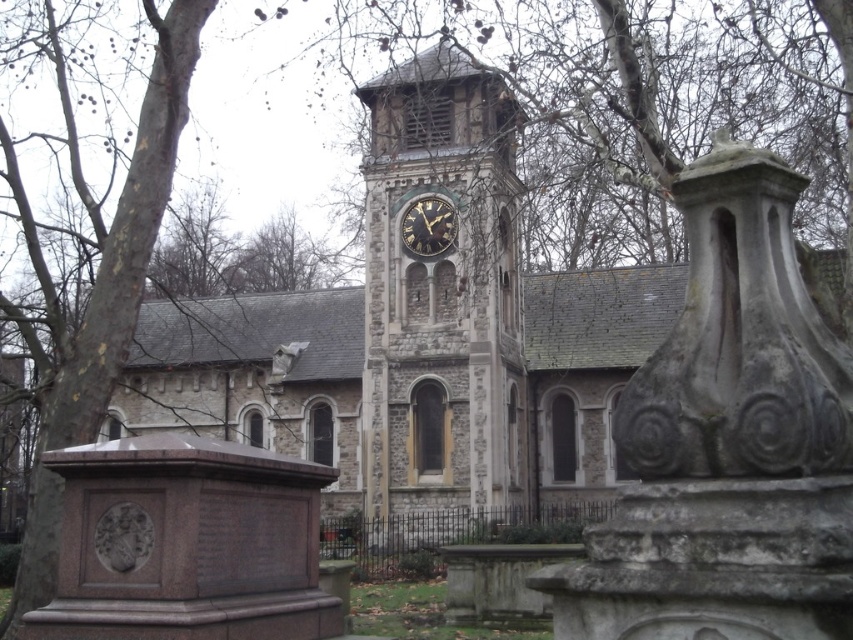
Does stone clock tower at center have a larger size compared to dark gray stone clock at center?

Correct, stone clock tower at center is larger in size than dark gray stone clock at center.

Who is higher up, stone clock tower at center or dark gray stone clock at center?

dark gray stone clock at center is higher up.

This screenshot has width=853, height=640. What do you see at coordinates (440, 300) in the screenshot?
I see `stone clock tower at center` at bounding box center [440, 300].

The width and height of the screenshot is (853, 640). I want to click on stone clock tower at center, so click(440, 300).